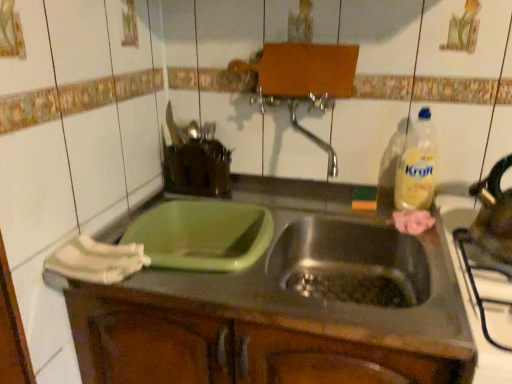
Question: Visually, is yellow plastic bottle at right positioned to the left or to the right of shiny metallic tea pot at right?

Choices:
 (A) right
 (B) left

Answer: (B)

Question: Considering the positions of yellow plastic bottle at right and shiny metallic tea pot at right in the image, is yellow plastic bottle at right taller or shorter than shiny metallic tea pot at right?

Choices:
 (A) tall
 (B) short

Answer: (A)

Question: Estimate the real-world distances between objects in this image. Which object is closer to the shiny metallic tea pot at right?

Choices:
 (A) yellow plastic bottle at right
 (B) green plastic container at center-left
 (C) stainless steel kettle at right

Answer: (C)

Question: Estimate the real-world distances between objects in this image. Which object is closer to the shiny metallic tea pot at right?

Choices:
 (A) stainless steel kettle at right
 (B) green plastic container at center-left
 (C) yellow plastic bottle at right

Answer: (A)